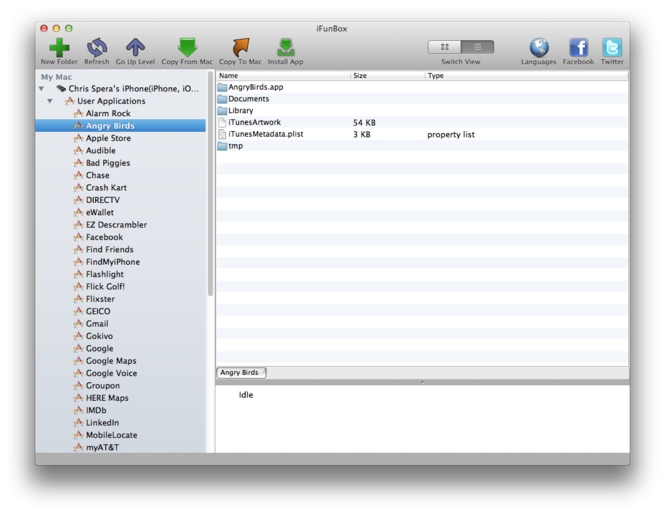
You are a GUI agent. You are given a task and a screenshot of the screen. Output one action in this format:
    pyautogui.click(x=<x>, y=<y>)
    Task: Click on the folders
    The width and height of the screenshot is (665, 514).
    Given the screenshot: What is the action you would take?
    pyautogui.click(x=221, y=88), pyautogui.click(x=221, y=100), pyautogui.click(x=221, y=109), pyautogui.click(x=221, y=146)